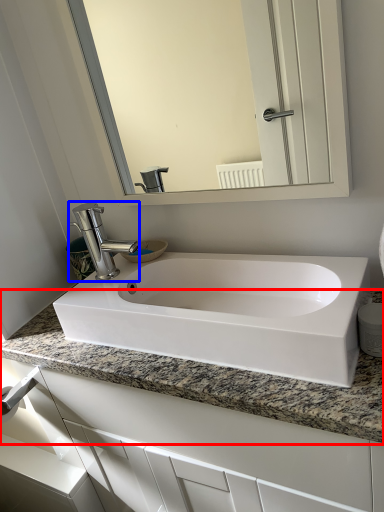
Question: Which of the following is the farthest to the observer, countertop (highlighted by a red box) or tap (highlighted by a blue box)?

Choices:
 (A) countertop
 (B) tap

Answer: (B)